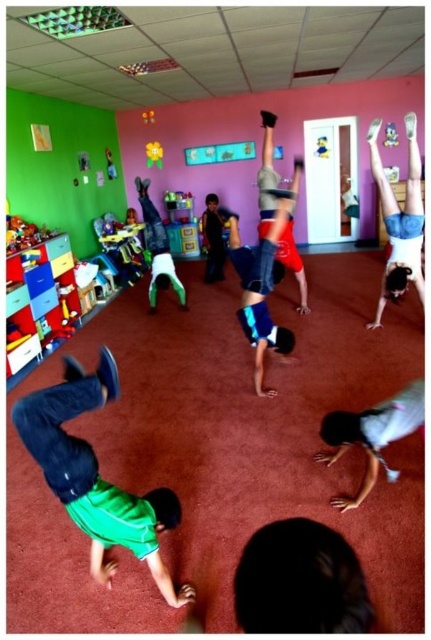
You are a child in the playroom and want to place your plush pink hedgehog at upper center onto the rubberized yellow ball at center. Can you do this without moving the ball?

The plush pink hedgehog at upper center is positioned on the right side of the rubberized yellow ball at center, so it is already placed on the ball. However, since the hedgehog is described as being on the right side of the ball, it might not be centered or stably placed. You might need to adjust its position to ensure it stays on the ball.